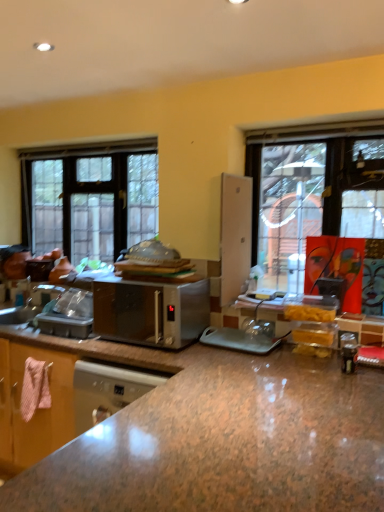
Question: Does clear glass window at left appear on the left side of brown granite countertop at center?

Choices:
 (A) no
 (B) yes

Answer: (B)

Question: From a real-world perspective, does clear glass window at left sit lower than brown granite countertop at center?

Choices:
 (A) no
 (B) yes

Answer: (A)

Question: Is brown granite countertop at center completely or partially inside clear glass window at left?

Choices:
 (A) no
 (B) yes

Answer: (A)

Question: From the image's perspective, is clear glass window at left on brown granite countertop at center?

Choices:
 (A) no
 (B) yes

Answer: (B)

Question: Is clear glass window at left next to brown granite countertop at center?

Choices:
 (A) yes
 (B) no

Answer: (B)

Question: Would you say clear glass window at left is outside brown granite countertop at center?

Choices:
 (A) no
 (B) yes

Answer: (B)

Question: From the image's perspective, would you say clear glass window at left is positioned over satin silver microwave at center?

Choices:
 (A) yes
 (B) no

Answer: (A)

Question: Does clear glass window at left have a smaller size compared to satin silver microwave at center?

Choices:
 (A) yes
 (B) no

Answer: (B)

Question: Does clear glass window at left have a larger size compared to satin silver microwave at center?

Choices:
 (A) yes
 (B) no

Answer: (A)

Question: Is clear glass window at left looking in the opposite direction of satin silver microwave at center?

Choices:
 (A) yes
 (B) no

Answer: (B)

Question: Is clear glass window at left closer to camera compared to satin silver microwave at center?

Choices:
 (A) yes
 (B) no

Answer: (B)

Question: Could you tell me if clear glass window at left is facing satin silver microwave at center?

Choices:
 (A) yes
 (B) no

Answer: (B)

Question: Is satin silver microwave at center located outside brown granite countertop at center?

Choices:
 (A) yes
 (B) no

Answer: (A)